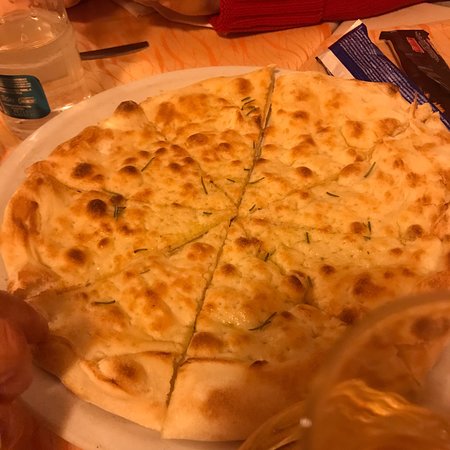
Where is `red napkin at the top`? red napkin at the top is located at coordinates (240, 19).